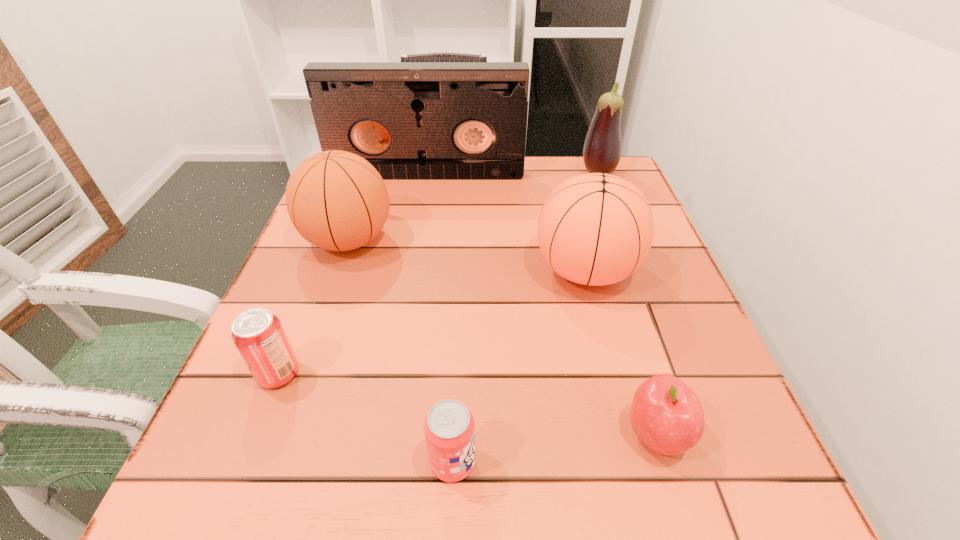
The width and height of the screenshot is (960, 540). What are the coordinates of `videotape` in the screenshot? It's located at (410, 120).

This screenshot has height=540, width=960. Identify the location of eggplant. (602, 148).

Image resolution: width=960 pixels, height=540 pixels. Identify the location of the right basketball. (595, 229).

Where is `the left basketball`? the left basketball is located at coordinates (336, 200).

Locate an element on the screen. the left soda can is located at coordinates tap(258, 335).

You are a GUI agent. You are given a task and a screenshot of the screen. Output one action in this format:
    pyautogui.click(x=<x>, y=<y>)
    Task: Click on the farther soda can
    The width and height of the screenshot is (960, 540).
    Given the screenshot: What is the action you would take?
    pyautogui.click(x=258, y=335)

You are a GUI agent. You are given a task and a screenshot of the screen. Output one action in this format:
    pyautogui.click(x=<x>, y=<y>)
    Task: Click on the nearer soda can
    The image size is (960, 540).
    Given the screenshot: What is the action you would take?
    pyautogui.click(x=449, y=428)

Identify the location of apple. (666, 415).

This screenshot has width=960, height=540. I want to click on free space located on the front side of the videotape, so click(x=419, y=224).

This screenshot has height=540, width=960. Identify the location of vacant region located 0.170m on the front of the eggplant. (616, 220).